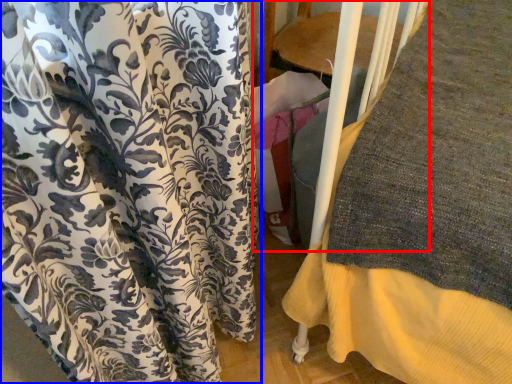
Question: Which point is further to the camera, bunk bed (highlighted by a red box) or curtain (highlighted by a blue box)?

Choices:
 (A) bunk bed
 (B) curtain

Answer: (A)